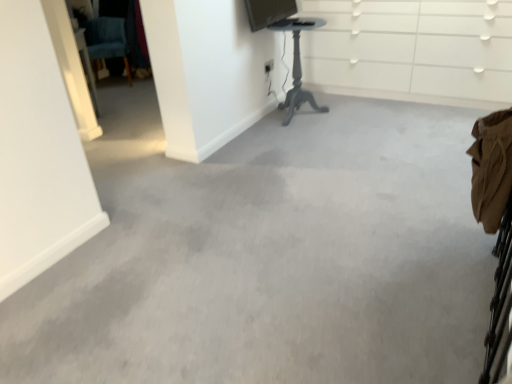
Question: From a real-world perspective, is white glossy dresser at upper center positioned under matte black monitor at upper center based on gravity?

Choices:
 (A) no
 (B) yes

Answer: (B)

Question: Is white glossy dresser at upper center to the right of matte black monitor at upper center from the viewer's perspective?

Choices:
 (A) no
 (B) yes

Answer: (B)

Question: Considering the relative positions of white glossy dresser at upper center and matte black monitor at upper center in the image provided, is white glossy dresser at upper center behind matte black monitor at upper center?

Choices:
 (A) yes
 (B) no

Answer: (A)

Question: Is white glossy dresser at upper center turned away from matte black monitor at upper center?

Choices:
 (A) no
 (B) yes

Answer: (A)

Question: Is white glossy dresser at upper center smaller than matte black monitor at upper center?

Choices:
 (A) yes
 (B) no

Answer: (B)

Question: Is white glossy dresser at upper center in front of or behind matte black monitor at upper center in the image?

Choices:
 (A) behind
 (B) front

Answer: (A)

Question: Is white glossy dresser at upper center taller or shorter than matte black monitor at upper center?

Choices:
 (A) short
 (B) tall

Answer: (B)

Question: Is point (458, 39) positioned closer to the camera than point (278, 8)?

Choices:
 (A) closer
 (B) farther

Answer: (B)

Question: From the image's perspective, relative to matte black monitor at upper center, is white glossy dresser at upper center above or below?

Choices:
 (A) above
 (B) below

Answer: (B)

Question: Is matte gray table at center taller or shorter than white glossy dresser at upper center?

Choices:
 (A) tall
 (B) short

Answer: (B)

Question: Based on their positions, is matte gray table at center located to the left or right of white glossy dresser at upper center?

Choices:
 (A) left
 (B) right

Answer: (A)

Question: Considering their positions, is matte gray table at center located in front of or behind white glossy dresser at upper center?

Choices:
 (A) front
 (B) behind

Answer: (B)

Question: Considering the positions of matte gray table at center and white glossy dresser at upper center in the image, is matte gray table at center bigger or smaller than white glossy dresser at upper center?

Choices:
 (A) big
 (B) small

Answer: (B)

Question: Considering the positions of teal fabric swivel chair at upper left and white glossy dresser at upper center in the image, is teal fabric swivel chair at upper left taller or shorter than white glossy dresser at upper center?

Choices:
 (A) short
 (B) tall

Answer: (A)

Question: Is teal fabric swivel chair at upper left to the left or to the right of white glossy dresser at upper center in the image?

Choices:
 (A) right
 (B) left

Answer: (B)